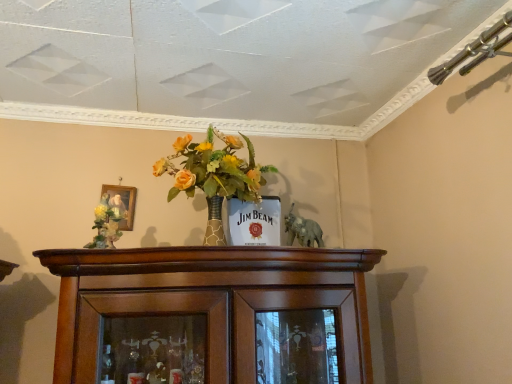
Question: Is gold-framed painting at upper left wider or thinner than matte floral arrangement at left?

Choices:
 (A) wide
 (B) thin

Answer: (B)

Question: Considering the positions of gold-framed painting at upper left and matte floral arrangement at left in the image, is gold-framed painting at upper left bigger or smaller than matte floral arrangement at left?

Choices:
 (A) small
 (B) big

Answer: (A)

Question: Which object is the closest to the gold-framed painting at upper left?

Choices:
 (A) matte floral arrangement at left
 (B) gray matte elephant at center

Answer: (A)

Question: Based on their relative distances, which object is nearer to the gray matte elephant at center?

Choices:
 (A) matte floral arrangement at left
 (B) gold-framed painting at upper left

Answer: (A)